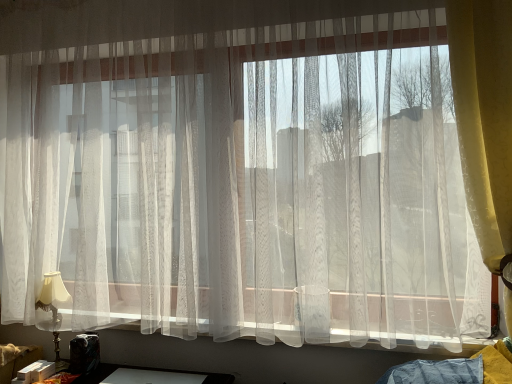
Locate an element on the screen. Image resolution: width=512 pixels, height=384 pixels. matte gold table lamp at left is located at coordinates (54, 309).

Describe the element at coordinates (54, 309) in the screenshot. I see `matte gold table lamp at left` at that location.

What do you see at coordinates (484, 117) in the screenshot? I see `yellow textured curtain at right` at bounding box center [484, 117].

The height and width of the screenshot is (384, 512). I want to click on yellow textured curtain at right, so click(x=484, y=117).

The height and width of the screenshot is (384, 512). What are the coordinates of `matte gold table lamp at left` in the screenshot? It's located at (54, 309).

Considering the positions of objects yellow textured curtain at right and matte gold table lamp at left in the image provided, who is more to the left, yellow textured curtain at right or matte gold table lamp at left?

matte gold table lamp at left is more to the left.

Does yellow textured curtain at right lie in front of matte gold table lamp at left?

Yes.

Does point (511, 102) come closer to viewer compared to point (57, 276)?

Yes.

From the image's perspective, which is below, yellow textured curtain at right or matte gold table lamp at left?

matte gold table lamp at left appears lower in the image.

From a real-world perspective, is yellow textured curtain at right below matte gold table lamp at left?

No.

Considering the relative sizes of yellow textured curtain at right and matte gold table lamp at left in the image provided, is yellow textured curtain at right wider than matte gold table lamp at left?

Correct, the width of yellow textured curtain at right exceeds that of matte gold table lamp at left.

Which of these two, yellow textured curtain at right or matte gold table lamp at left, stands shorter?

matte gold table lamp at left is shorter.

Based on their sizes in the image, would you say yellow textured curtain at right is bigger or smaller than matte gold table lamp at left?

yellow textured curtain at right is bigger than matte gold table lamp at left.

Would you say matte gold table lamp at left is part of yellow textured curtain at right's contents?

That's incorrect, matte gold table lamp at left is not inside yellow textured curtain at right.

Is yellow textured curtain at right far away from matte gold table lamp at left?

Yes, yellow textured curtain at right and matte gold table lamp at left are quite far apart.

Is yellow textured curtain at right facing towards matte gold table lamp at left?

No.

How many degrees apart are the facing directions of yellow textured curtain at right and matte gold table lamp at left?

48.4 degrees.

This screenshot has height=384, width=512. In order to click on curtain lying in front of the matte gold table lamp at left in this screenshot , I will do `click(484, 117)`.

Considering the positions of objects matte gold table lamp at left and yellow textured curtain at right in the image provided, who is more to the right, matte gold table lamp at left or yellow textured curtain at right?

From the viewer's perspective, yellow textured curtain at right appears more on the right side.

Is matte gold table lamp at left closer to the viewer compared to yellow textured curtain at right?

No, it is behind yellow textured curtain at right.

Does point (55, 308) appear closer or farther from the camera than point (483, 6)?

Point (55, 308).

From the image's perspective, between matte gold table lamp at left and yellow textured curtain at right, which one is located above?

yellow textured curtain at right.

From a real-world perspective, is matte gold table lamp at left positioned under yellow textured curtain at right based on gravity?

Yes.

Which object is wider, matte gold table lamp at left or yellow textured curtain at right?

yellow textured curtain at right.

Between matte gold table lamp at left and yellow textured curtain at right, which one has more height?

With more height is yellow textured curtain at right.

Does matte gold table lamp at left have a smaller size compared to yellow textured curtain at right?

Correct, matte gold table lamp at left occupies less space than yellow textured curtain at right.

Would you say matte gold table lamp at left is inside or outside yellow textured curtain at right?

matte gold table lamp at left cannot be found inside yellow textured curtain at right.

Can you see matte gold table lamp at left touching yellow textured curtain at right?

matte gold table lamp at left is not next to yellow textured curtain at right, and they're not touching.

Is matte gold table lamp at left oriented away from yellow textured curtain at right?

No.

Find the location of `table lamp below the yellow textured curtain at right (from the image's perspective)`. table lamp below the yellow textured curtain at right (from the image's perspective) is located at coordinates (54, 309).

What are the coordinates of `table lamp lying on the left of yellow textured curtain at right` in the screenshot? It's located at [54, 309].

The width and height of the screenshot is (512, 384). In the image, there is a matte gold table lamp at left. Identify the location of curtain above it (from the image's perspective). (484, 117).